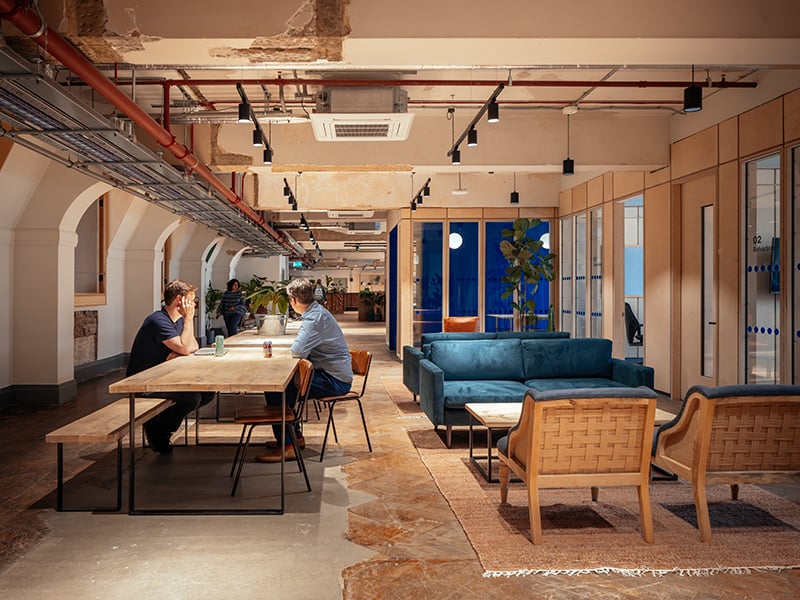
The width and height of the screenshot is (800, 600). I want to click on ceiling, so click(430, 91).